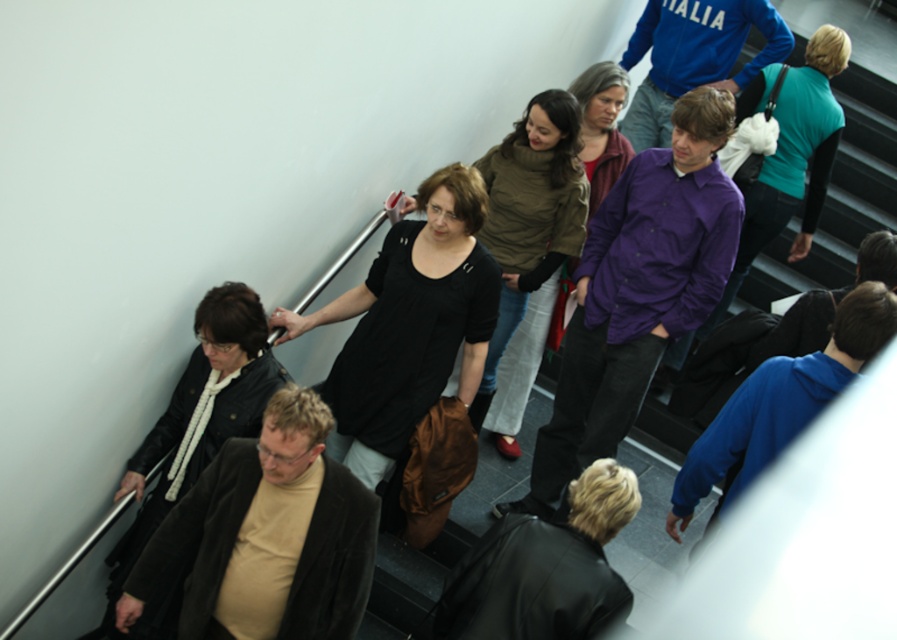
Does black leather jacket at lower left come in front of black matte dress at center?

Yes, it is in front of black matte dress at center.

Which is above, black leather jacket at lower left or black matte dress at center?

Positioned higher is black matte dress at center.

Who is more distant from viewer, (207, 317) or (416, 195)?

The point (416, 195) is behind.

Find the location of a particular element. The image size is (897, 640). black leather jacket at lower left is located at coordinates (197, 433).